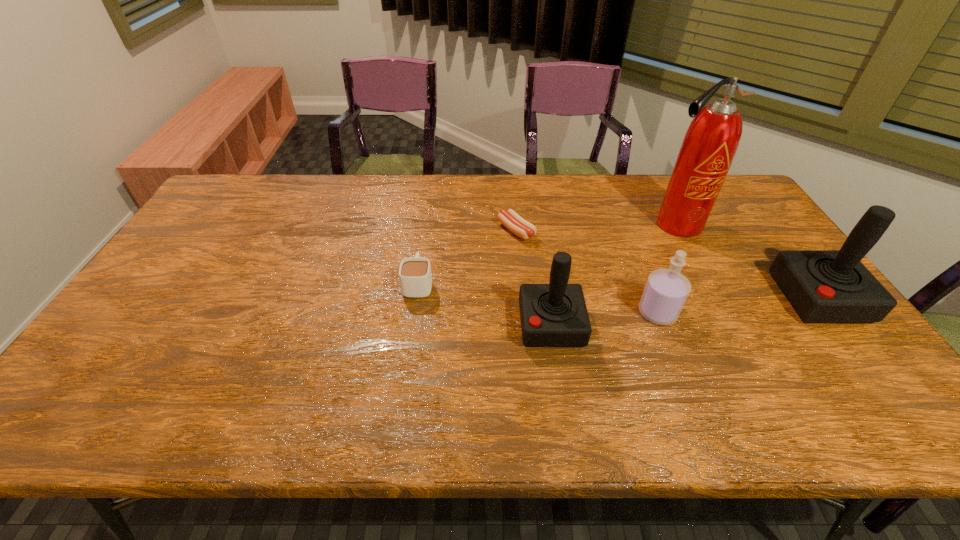
What are the coordinates of `free space in the image that satisfies the following two spatial constraints: 1. on the side with the handle of the leftmost object; 2. on the left side of the shortest object` in the screenshot? It's located at (425, 231).